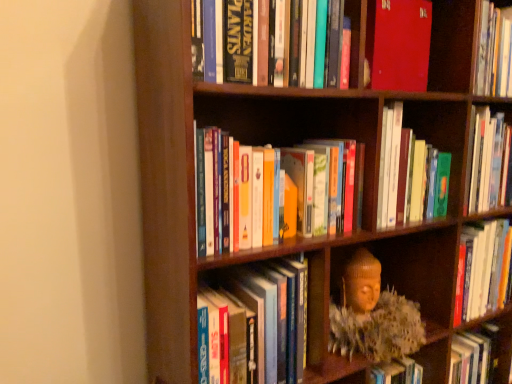
Question: In which direction should I rotate to look at hardcover books at upper center, the 2th book viewed from the top?

Choices:
 (A) right
 (B) left

Answer: (A)

Question: Is hardcover books at center, which ranks as the 3th book in bottom-to-top order, not inside wooden bookcase at center?

Choices:
 (A) no
 (B) yes

Answer: (A)

Question: Is hardcover books at center, the 3th book in the top-to-bottom sequence, behind wooden bookcase at center?

Choices:
 (A) yes
 (B) no

Answer: (A)

Question: Is hardcover books at center, the 3th book in the top-to-bottom sequence, to the left of wooden bookcase at center from the viewer's perspective?

Choices:
 (A) yes
 (B) no

Answer: (B)

Question: Considering the relative sizes of hardcover books at center, the 3th book in the top-to-bottom sequence, and wooden bookcase at center in the image provided, is hardcover books at center, the 3th book in the top-to-bottom sequence, smaller than wooden bookcase at center?

Choices:
 (A) yes
 (B) no

Answer: (A)

Question: Is the position of hardcover books at center, the 3th book in the top-to-bottom sequence, less distant than that of wooden bookcase at center?

Choices:
 (A) yes
 (B) no

Answer: (B)

Question: Does hardcover books at center, which ranks as the 3th book in bottom-to-top order, have a larger size compared to wooden bookcase at center?

Choices:
 (A) yes
 (B) no

Answer: (B)

Question: From a real-world perspective, is hardcover books at upper center, the 2th book viewed from the top, physically above hardcover books at center, arranged as the 4th book when viewed from the top?

Choices:
 (A) no
 (B) yes

Answer: (B)

Question: Does hardcover books at upper center, placed as the fourth book when sorted from bottom to top, have a greater width compared to hardcover books at center, arranged as the 4th book when viewed from the top?

Choices:
 (A) no
 (B) yes

Answer: (A)

Question: Is hardcover books at upper center, the 2th book viewed from the top, aimed at hardcover books at center, arranged as the 4th book when viewed from the top?

Choices:
 (A) no
 (B) yes

Answer: (A)

Question: Does hardcover books at upper center, placed as the fourth book when sorted from bottom to top, have a lesser height compared to hardcover books at center, the second book when ordered from bottom to top?

Choices:
 (A) yes
 (B) no

Answer: (A)

Question: Is hardcover books at upper center, the 2th book viewed from the top, taller than hardcover books at center, arranged as the 4th book when viewed from the top?

Choices:
 (A) yes
 (B) no

Answer: (B)

Question: Is hardcover books at upper center, placed as the fourth book when sorted from bottom to top, positioned with its back to hardcover books at center, arranged as the 4th book when viewed from the top?

Choices:
 (A) no
 (B) yes

Answer: (A)

Question: Does matte red book at upper center, marked as the 5th book in a bottom-to-top arrangement, have a lesser height compared to wooden bookcase at center?

Choices:
 (A) yes
 (B) no

Answer: (A)